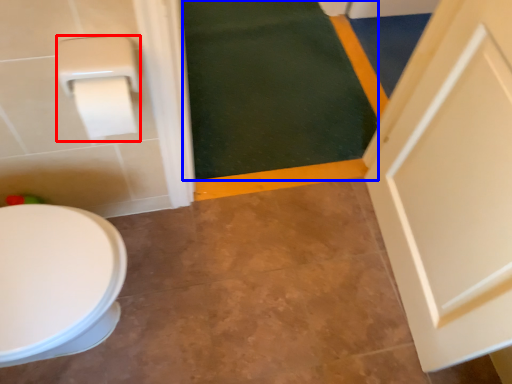
Question: Which object appears closest to the camera in this image, toilet paper (highlighted by a red box) or bath mat (highlighted by a blue box)?

Choices:
 (A) toilet paper
 (B) bath mat

Answer: (A)